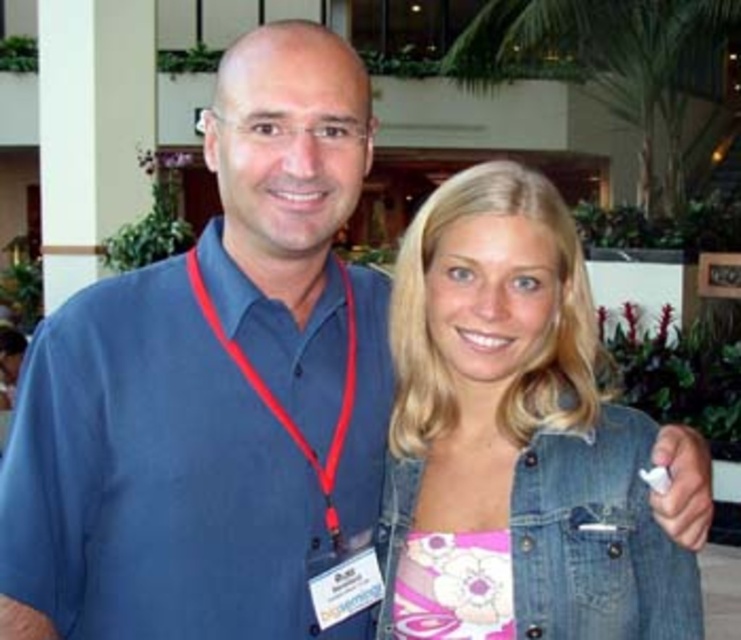
Measure the distance between denim jacket at right and camera.

denim jacket at right and camera are 1.58 meters apart.

Is denim jacket at right positioned at the back of red fabric lanyard at center?

No, denim jacket at right is closer to the viewer.

Between point (617, 600) and point (285, 422), which one is positioned behind?

The point (285, 422) is behind.

I want to click on denim jacket at right, so click(x=514, y=435).